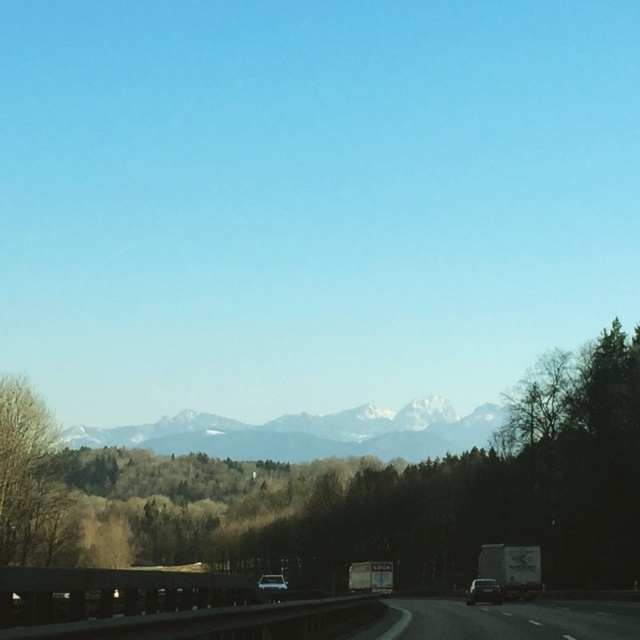
You are a passenger in a car driving on the highway. You notice the bare branches at left and the shiny black car at center. Which object is closer to the road?

The shiny black car at center is closer to the road because the bare branches at left are positioned over it, indicating it is further away from the road compared to the car.

You are standing at the point marked by point (29, 480) in the image. Looking around, which direction would you face to see the bare branches at left?

The point (29, 480) is where the bare branches at left are located, so you are already facing the bare branches at left.